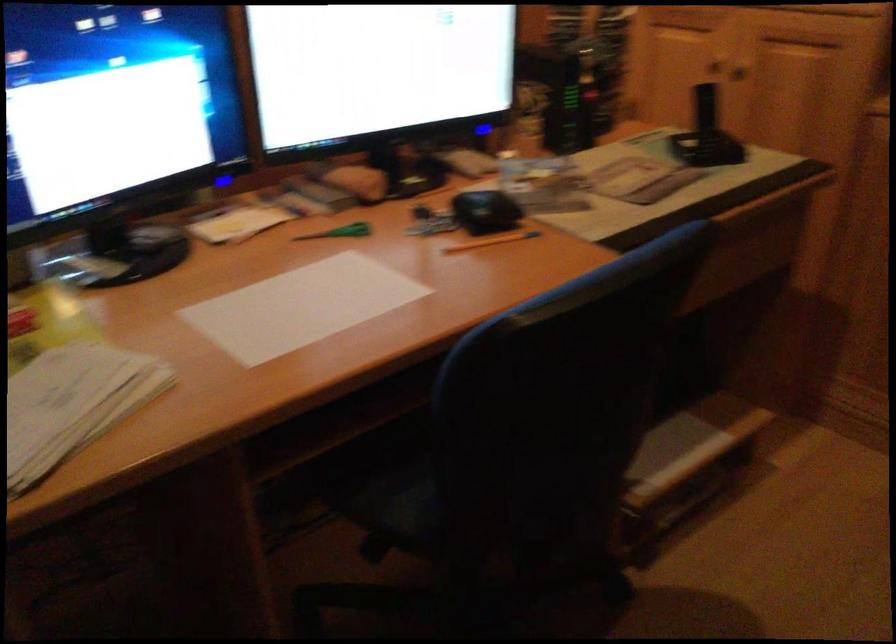
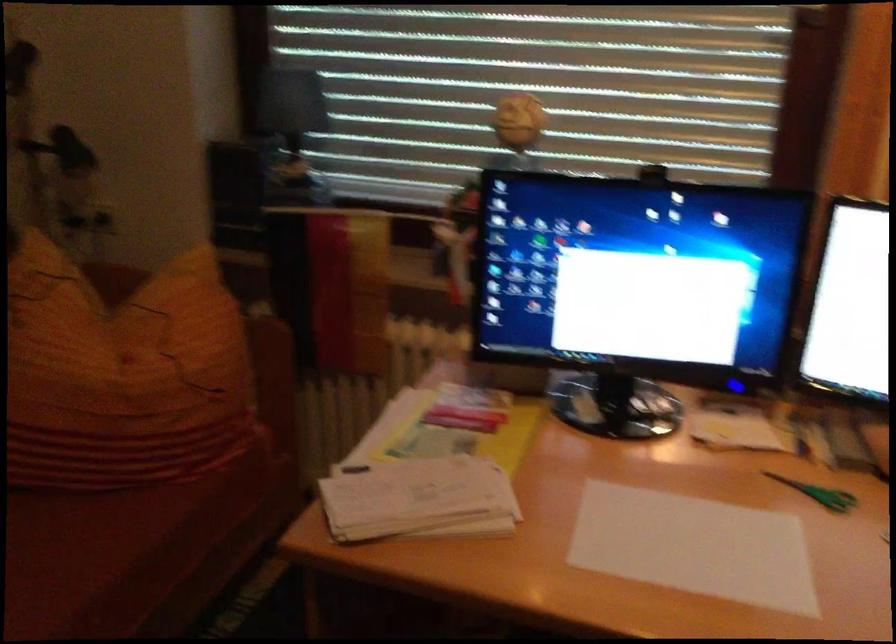
Question: The images are taken continuously from a first-person perspective. In which direction is your viewpoint rotating?

Choices:
 (A) Left
 (B) Right
 (C) Up
 (D) Down

Answer: (A)